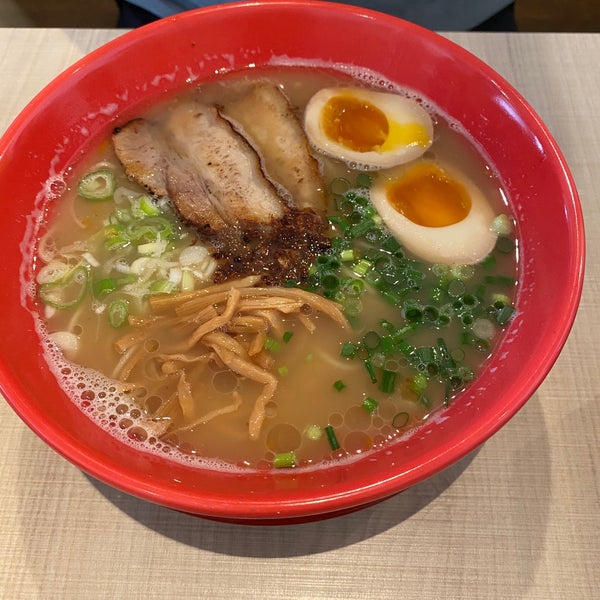
Where is `tan table cloth`? This screenshot has width=600, height=600. tan table cloth is located at coordinates (480, 516).